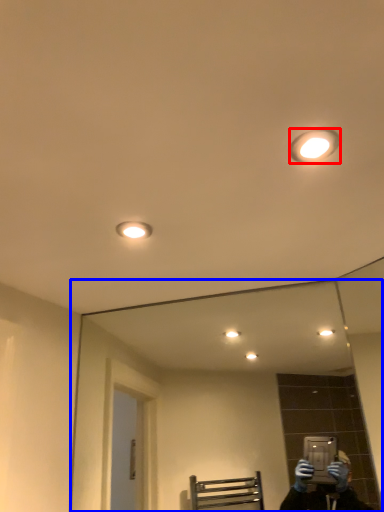
Question: Among these objects, which one is farthest to the camera, light fixture (highlighted by a red box) or mirror (highlighted by a blue box)?

Choices:
 (A) light fixture
 (B) mirror

Answer: (B)